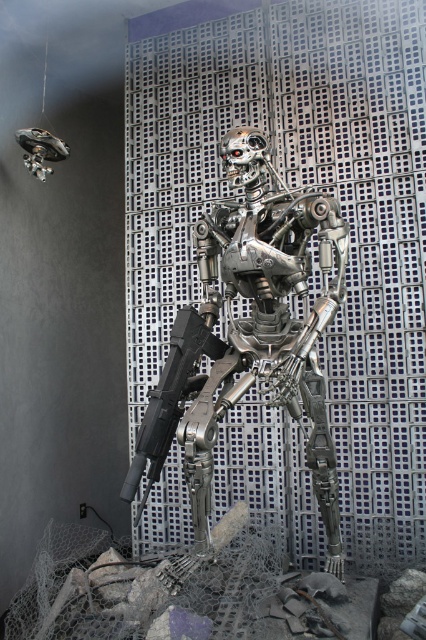
You are a maintenance technician standing 6 feet away from the metallic robot at center. Can you safely approach it without needing to move further back?

The metallic robot at center is 6.13 feet away from the viewer. Since you are already standing 6 feet away, you are slightly closer than the measured distance, so you can safely approach it without needing to move further back.

You are a security guard in a high tech facility. You see the metallic robot at center and the black matte gun at center. Which object is closer to you?

The metallic robot at center is closer to you because it is positioned over the black matte gun at center, indicating it is in front of it.